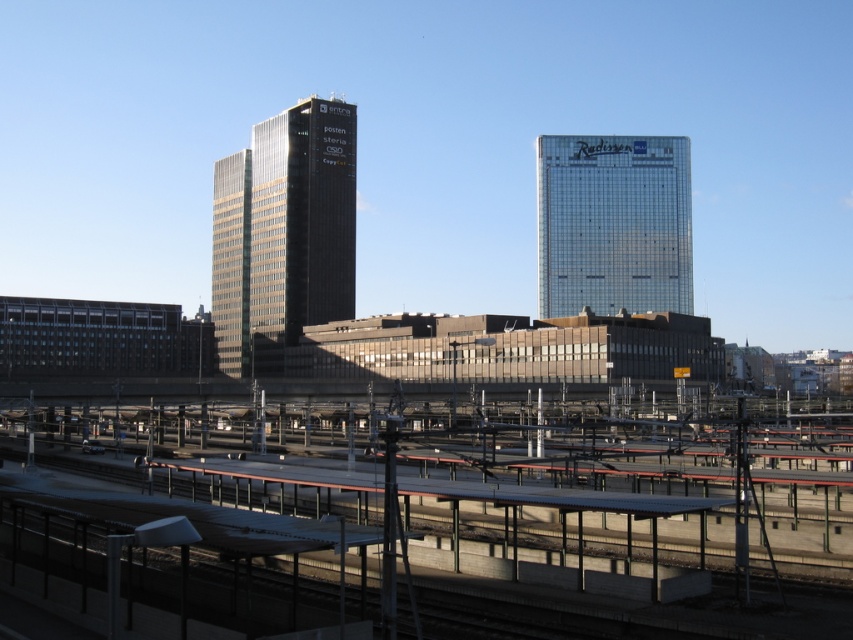
Question: Among these points, which one is nearest to the camera?

Choices:
 (A) (659, 248)
 (B) (244, 252)
 (C) (45, 461)
 (D) (28, 356)

Answer: (C)

Question: Does concrete platform at lower center appear under black glass building at lower left?

Choices:
 (A) no
 (B) yes

Answer: (B)

Question: Which of the following is the farthest from the observer?

Choices:
 (A) transparent glass building at center
 (B) black glass tower at center
 (C) concrete platform at lower center
 (D) black glass building at lower left

Answer: (A)

Question: Among these points, which one is nearest to the camera?

Choices:
 (A) (291, 120)
 (B) (207, 317)
 (C) (665, 253)
 (D) (212, 516)

Answer: (D)

Question: Does transparent glass building at center have a greater width compared to black glass building at lower left?

Choices:
 (A) yes
 (B) no

Answer: (A)

Question: In this image, where is black glass tower at center located relative to transparent glass building at center?

Choices:
 (A) right
 (B) left

Answer: (B)